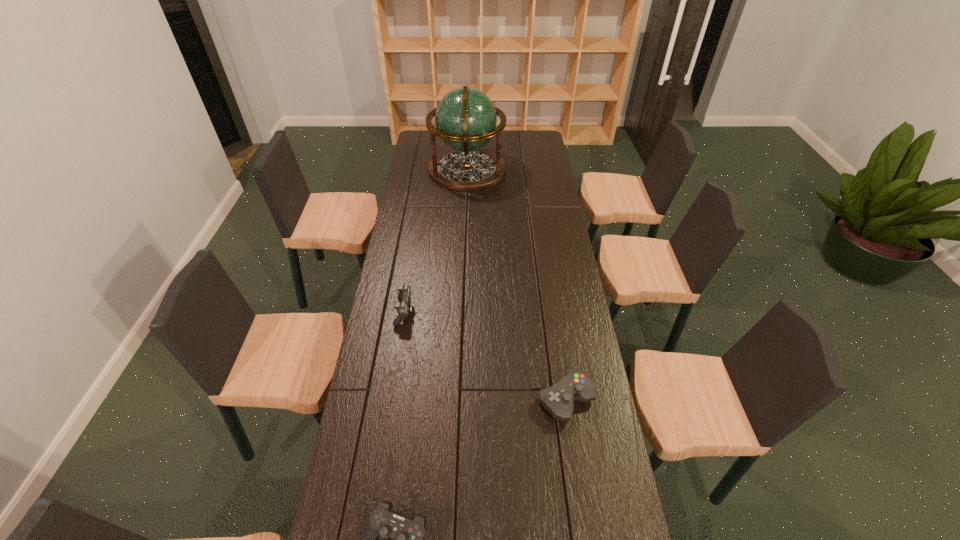
This screenshot has width=960, height=540. Find the location of `globe present at the left edge`. globe present at the left edge is located at coordinates (465, 119).

Locate an element on the screen. This screenshot has width=960, height=540. control at the left edge is located at coordinates (404, 295).

The height and width of the screenshot is (540, 960). In order to click on object that is at the right edge in this screenshot , I will do pos(558,400).

Identify the location of object present at the far left corner. The image size is (960, 540). (465, 119).

This screenshot has width=960, height=540. Find the location of `free spot at the left edge of the desktop`. free spot at the left edge of the desktop is located at coordinates (383, 501).

The height and width of the screenshot is (540, 960). I want to click on vacant space at the right edge of the desktop, so click(599, 408).

Image resolution: width=960 pixels, height=540 pixels. In order to click on vacant space at the far right corner in this screenshot , I will do `click(540, 141)`.

The height and width of the screenshot is (540, 960). In order to click on empty space that is in between the farthest control and the rightmost control in this screenshot , I will do `click(486, 355)`.

This screenshot has height=540, width=960. I want to click on unoccupied position between the farthest object and the second nearest object, so click(516, 284).

The image size is (960, 540). Find the location of `empty location between the globe and the second farthest object`. empty location between the globe and the second farthest object is located at coordinates (436, 241).